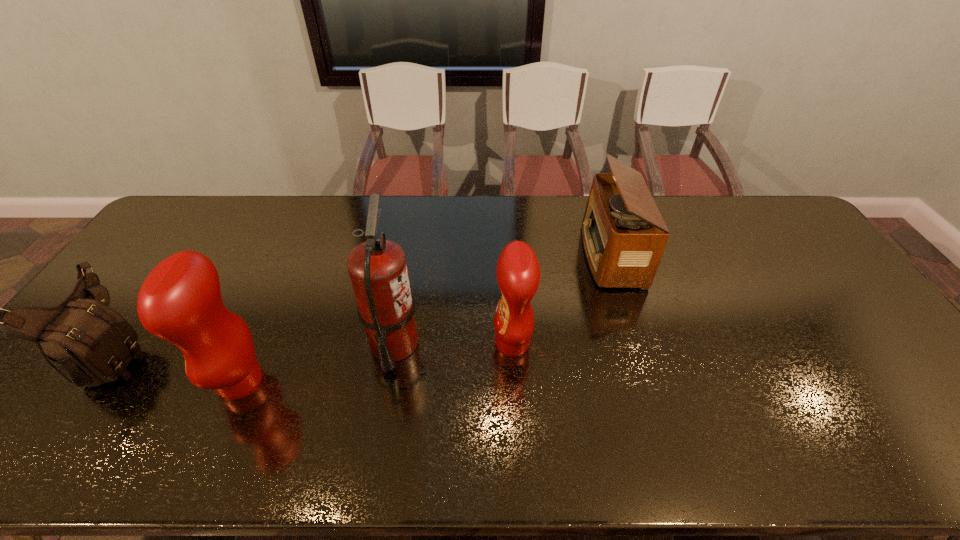
The height and width of the screenshot is (540, 960). Identify the location of condiment that is positioned at the near edge. [180, 301].

Identify the location of shoulder bag positioned at the near edge. (87, 342).

Find the location of a particular element. The image size is (960, 540). object located at the left edge is located at coordinates (87, 342).

Where is `object present at the near left corner`? object present at the near left corner is located at coordinates (87, 342).

Identify the location of blank space at the far edge. This screenshot has width=960, height=540. (316, 227).

Locate an element on the screen. vacant space at the near edge is located at coordinates (683, 411).

The image size is (960, 540). In the image, there is a desktop. What are the coordinates of `vacant space at the far left corner` in the screenshot? It's located at (208, 197).

What are the coordinates of `empty location between the third object from left to right and the taller condiment` in the screenshot? It's located at click(317, 362).

You are a GUI agent. You are given a task and a screenshot of the screen. Output one action in this format:
    pyautogui.click(x=<x>, y=<y>)
    Task: Click on the vacant region between the taller condiment and the shorter condiment
    This screenshot has height=540, width=960.
    Given the screenshot: What is the action you would take?
    pyautogui.click(x=376, y=362)

The image size is (960, 540). I want to click on empty space that is in between the fourth object from right to left and the third object from left to right, so click(317, 362).